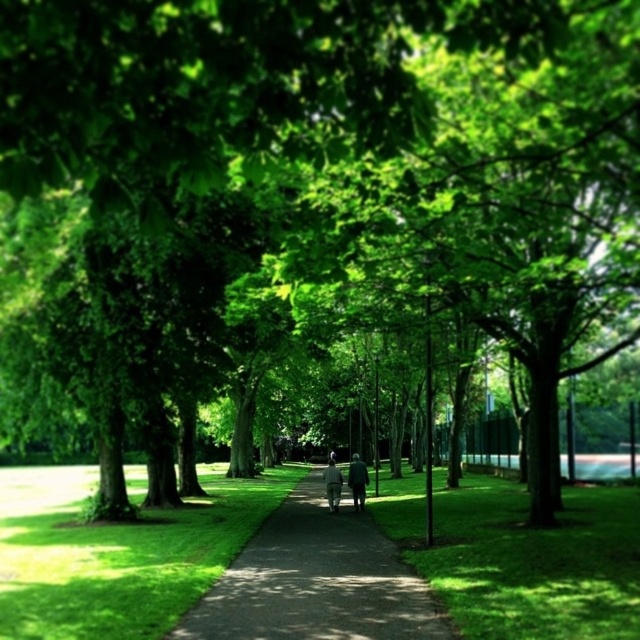
You are a person standing on the pathway in the park. You notice the green grass at center and the dark gray suit at center. Which object is taller?

The green grass at center is taller than the dark gray suit at center.

You are planning to walk along the dark gray asphalt path at center while wearing the dark gray suit at center. Considering the weather is sunny, which of the two items would likely absorb more heat and why?

The dark gray asphalt path at center is bigger than dark gray suit at center, so the asphalt path would absorb more heat because larger surfaces generally retain and absorb more heat, especially under direct sunlight.